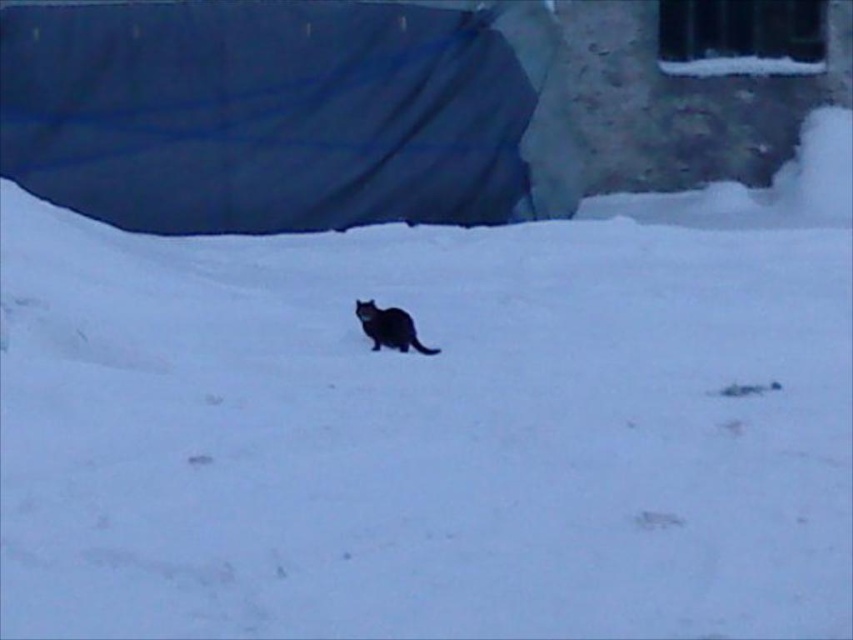
You are an observer standing in the snowy area. You see the dark blue fabric at upper left and the black fur cat at center. Which object is higher in the image?

The dark blue fabric at upper left is taller than the black fur cat at center.

You are a photographer trying to capture the black fur cat at center and the dark blue fabric at upper left in the same frame. Which object is closer to you, the photographer?

The dark blue fabric at upper left is closer to you than the black fur cat at center.